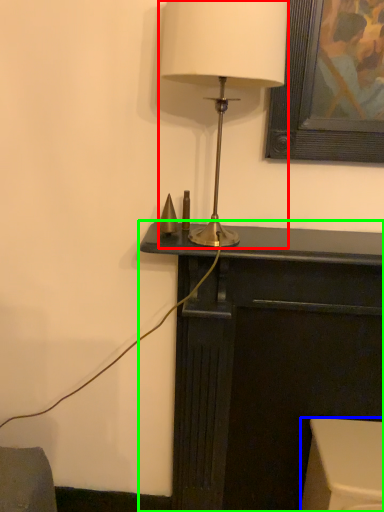
Question: Which object is positioned farthest from lamp (highlighted by a red box)? Select from furniture (highlighted by a blue box) and furniture (highlighted by a green box).

Choices:
 (A) furniture
 (B) furniture

Answer: (A)